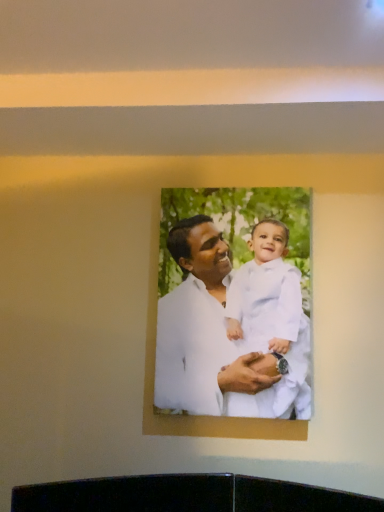
Describe the element at coordinates (194, 415) in the screenshot. The image size is (384, 512). I see `white paper at center` at that location.

Where is `white paper at center`? The image size is (384, 512). white paper at center is located at coordinates (194, 415).

Locate an element on the screen. The image size is (384, 512). white paper at center is located at coordinates (194, 415).